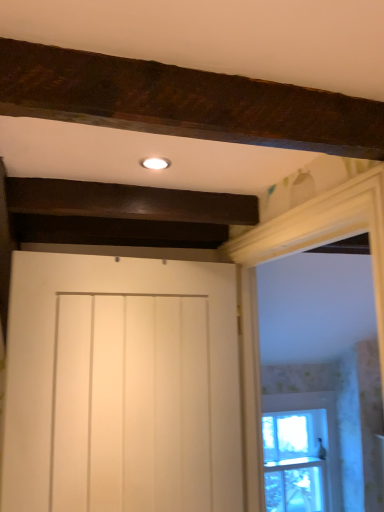
Question: Considering the positions of point (261, 481) and point (107, 334), is point (261, 481) closer or farther from the camera than point (107, 334)?

Choices:
 (A) closer
 (B) farther

Answer: (B)

Question: Is white wood frame at upper right taller or shorter than white matte door at center?

Choices:
 (A) short
 (B) tall

Answer: (B)

Question: Considering the real-world distances, which object is farthest from the white matte door at center?

Choices:
 (A) clear glass window at right
 (B) white wood frame at upper right

Answer: (A)

Question: Based on their relative distances, which object is nearer to the white matte door at center?

Choices:
 (A) white wood frame at upper right
 (B) clear glass window at right

Answer: (A)